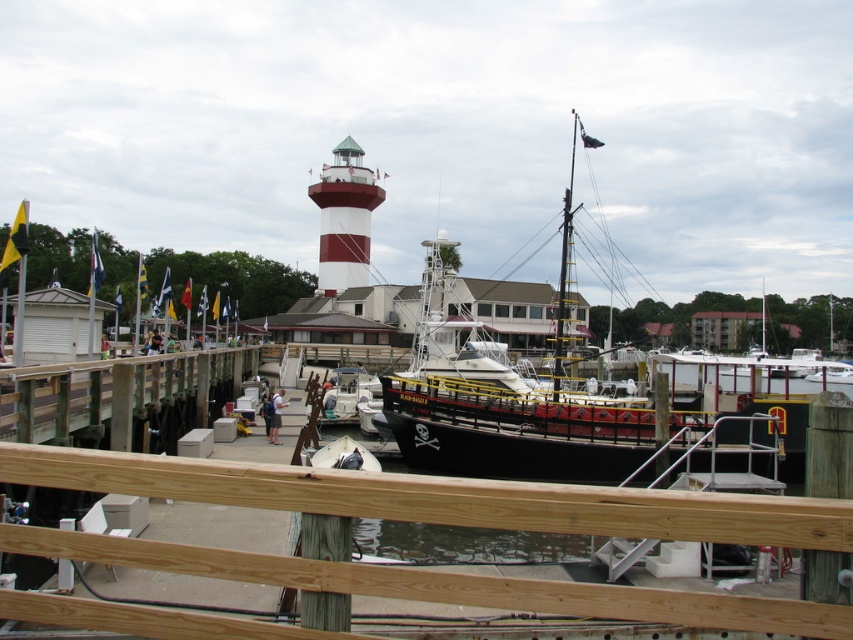
You are standing on the dock and see the wooden at center and the blue fabric shirt at center. Which object is closer to you?

The wooden at center is closer to you because it is in front of the blue fabric shirt at center.

You are standing on the dock and want to place a new wooden bench exactly at the center of the wooden at center. Based on the coordinates provided, where should you place the bench?

The wooden bench should be placed at the coordinates point (439, 499) since that is the 2D location of the wooden at center.